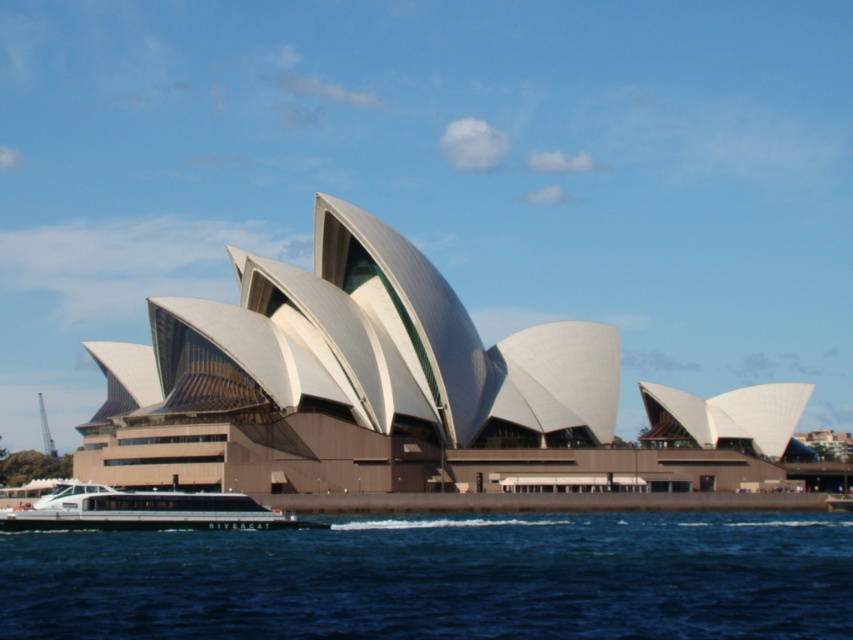
You are standing on the deck of the ferry named RIVERCAT and looking towards the Sydney Opera House. Which object is closer to you between the white smooth building at center and the blue water at lower center?

The white smooth building at center is closer to you than the blue water at lower center because the description states that the white smooth building at center is further to the viewer than blue water at lower center. Wait, that seems contradictory. Let me check again. The Objects Description says the white smooth building is further to the viewer than the blue water. Hmm, so if the building is further away from the viewer, then the blue water is closer. But the question asks which is closer between the 2.